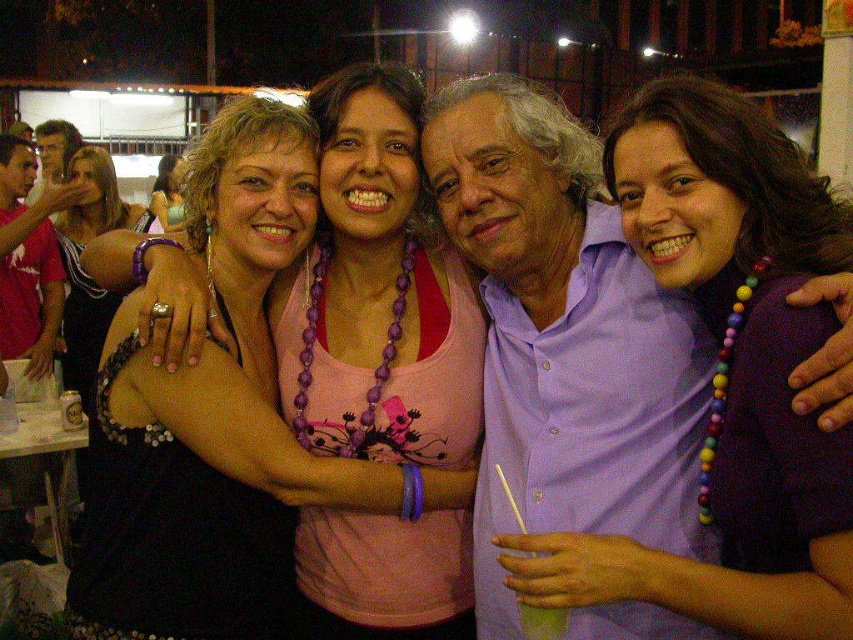
Question: Is purple beaded necklace at center behind green translucent cup at lower center?

Choices:
 (A) yes
 (B) no

Answer: (B)

Question: Which point is closer to the camera?

Choices:
 (A) pink fabric tank top at center
 (B) matte black dress at center
 (C) purple beaded necklace at center

Answer: (C)

Question: From the image, what is the correct spatial relationship of pink fabric tank top at center in relation to green translucent cup at lower center?

Choices:
 (A) right
 (B) left

Answer: (B)

Question: Which object is positioned closest to the green translucent cup at lower center?

Choices:
 (A) purple beaded necklace at center
 (B) matte black dress at center

Answer: (A)

Question: Among these points, which one is nearest to the camera?

Choices:
 (A) (91, 218)
 (B) (703, 276)
 (C) (253, 346)

Answer: (B)

Question: Does purple beaded necklace at center have a lesser width compared to matte black dress at center?

Choices:
 (A) yes
 (B) no

Answer: (A)